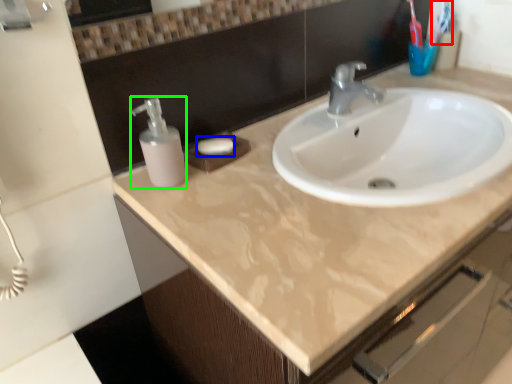
Question: Which object is positioned farthest from toothbrush (highlighted by a red box)? Select from soap (highlighted by a blue box) and soap dispenser (highlighted by a green box).

Choices:
 (A) soap
 (B) soap dispenser

Answer: (B)